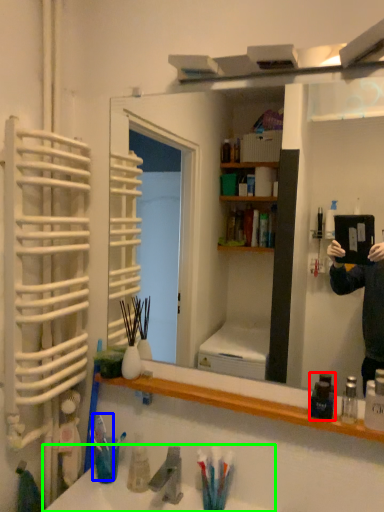
Question: Estimate the real-world distances between objects in this image. Which object is farther from mouthwash (highlighted by a red box), toothbrush (highlighted by a blue box) or sink (highlighted by a green box)?

Choices:
 (A) toothbrush
 (B) sink

Answer: (A)